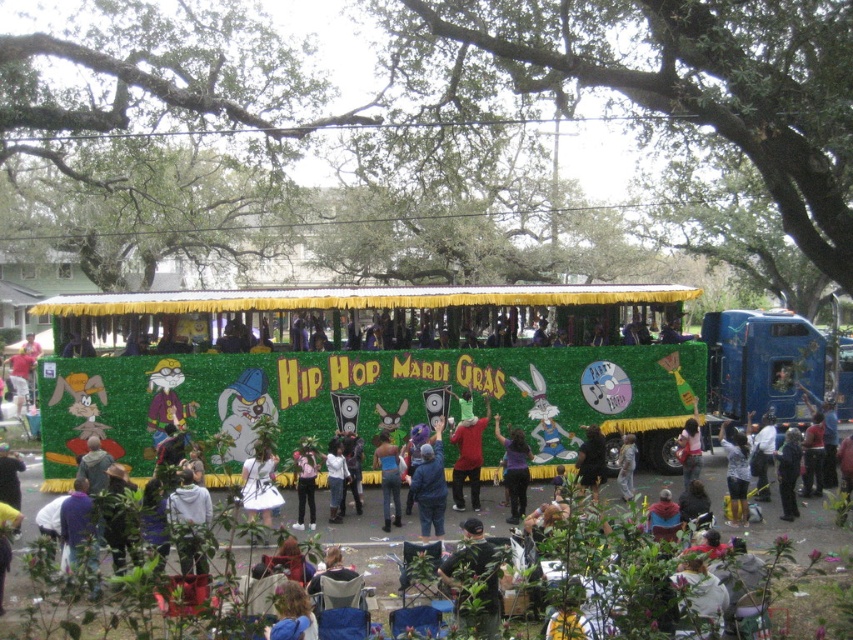
Question: Which of the following is the closest to the observer?

Choices:
 (A) (686, 436)
 (B) (730, 497)
 (C) (312, 524)

Answer: (C)

Question: Does multicolored fabric crowd at center have a greater width compared to dark gray fabric jacket at lower center?

Choices:
 (A) yes
 (B) no

Answer: (A)

Question: Estimate the real-world distances between objects in this image. Which object is farther from the white cotton shirt at center?

Choices:
 (A) matte pink shirt at center
 (B) pink fabric dress at center

Answer: (B)

Question: Which of the following is the closest to the observer?

Choices:
 (A) (440, 429)
 (B) (683, 435)
 (C) (474, 458)

Answer: (C)

Question: Can you confirm if purple matte shirt at center is positioned to the left of white matte shirt at lower right?

Choices:
 (A) yes
 (B) no

Answer: (A)

Question: Can you confirm if denim jeans at center is positioned to the right of white cotton shirt at center?

Choices:
 (A) no
 (B) yes

Answer: (B)